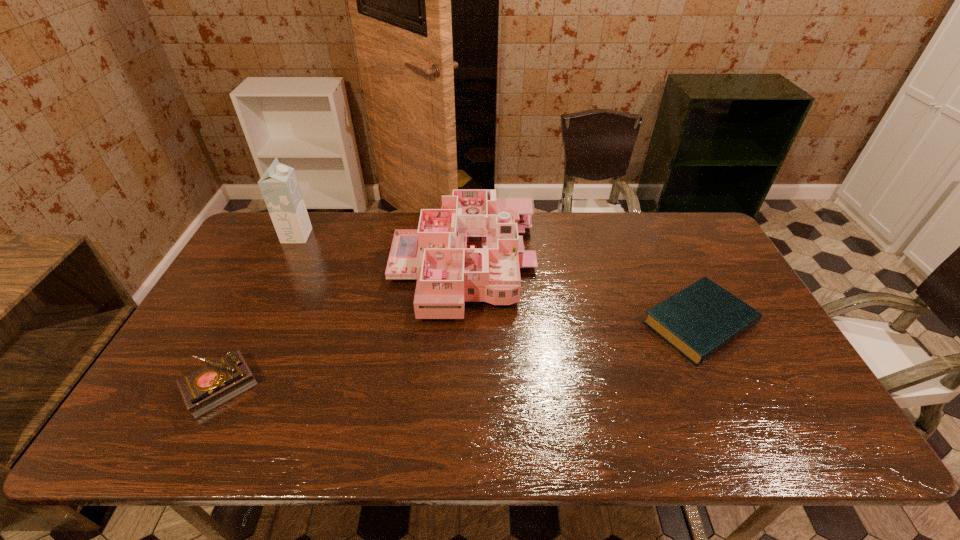
You are a GUI agent. You are given a task and a screenshot of the screen. Output one action in this format:
    pyautogui.click(x=<x>, y=<y>)
    Task: Click on the carton
    
    Given the screenshot: What is the action you would take?
    coord(279,186)

The image size is (960, 540). I want to click on the second object from right to left, so click(469, 251).

You are a GUI agent. You are given a task and a screenshot of the screen. Output one action in this format:
    pyautogui.click(x=<x>, y=<y>)
    Task: Click on the dollhouse
    The height and width of the screenshot is (540, 960).
    Given the screenshot: What is the action you would take?
    pyautogui.click(x=469, y=251)

Image resolution: width=960 pixels, height=540 pixels. I want to click on the second shortest object, so click(218, 382).

Where is `the shortest object`? Image resolution: width=960 pixels, height=540 pixels. the shortest object is located at coordinates (701, 319).

Where is `book`? book is located at coordinates (701, 319).

Locate an element on the screen. Image resolution: width=960 pixels, height=540 pixels. free space located 0.150m on the front label of the carton is located at coordinates (352, 236).

In order to click on free space located at the front entrance of the third shortest object in this screenshot , I will do `click(555, 265)`.

Where is `vacant space situated 0.320m on the right of the second shortest object`? vacant space situated 0.320m on the right of the second shortest object is located at coordinates (388, 386).

Find the location of a particular element. free space located on the back of the rightmost object is located at coordinates (661, 245).